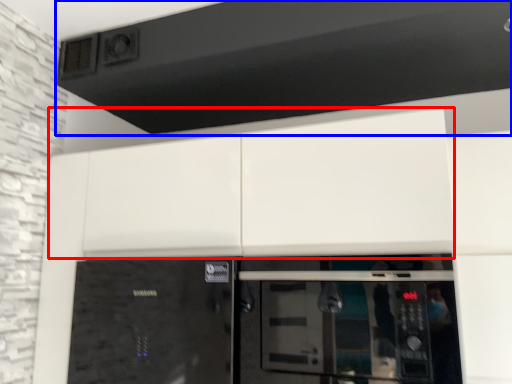
Question: Among these objects, which one is nearest to the camera, cabinetry (highlighted by a red box) or exhaust hood (highlighted by a blue box)?

Choices:
 (A) cabinetry
 (B) exhaust hood

Answer: (A)